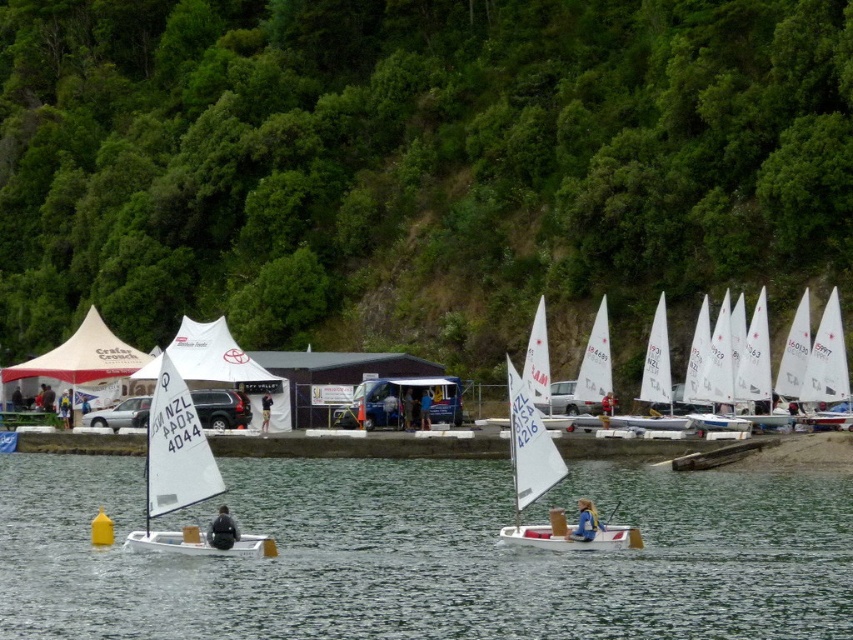
You are a sailor in a race and your boat is the white matte sailboat at left. You want to catch up to the white matte sailboat at center. The distance between them is 8.40 meters. If your boat can move at 2.5 meters per second and theirs is moving at 2.0 meters per second in the same direction, how many seconds will it take to overtake them?

The white matte sailboat at left is 8.40 meters behind the white matte sailboat at center. Since your boat moves faster by 0.5 meters per second, it will take 16.8 seconds to overtake them.

You are a photographer trying to capture the white matte sailboat at left and the green leafy hillside at upper center in a single shot. Based on their positions, which object is located to the left of the other?

The green leafy hillside at upper center is positioned on the left side of white matte sailboat at left, so the green leafy hillside at upper center is to the left of the white matte sailboat at left.